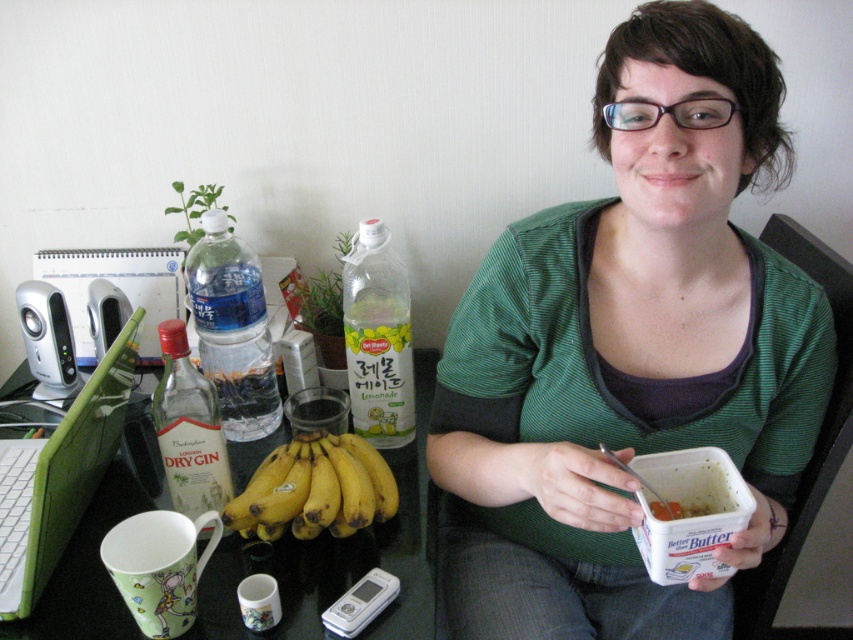
Is green striped shirt at center to the right of translucent plastic bottle at center from the viewer's perspective?

Correct, you'll find green striped shirt at center to the right of translucent plastic bottle at center.

Describe the element at coordinates (630, 349) in the screenshot. This screenshot has width=853, height=640. I see `green striped shirt at center` at that location.

Image resolution: width=853 pixels, height=640 pixels. What do you see at coordinates (630, 349) in the screenshot?
I see `green striped shirt at center` at bounding box center [630, 349].

Locate an element on the screen. green striped shirt at center is located at coordinates pyautogui.click(x=630, y=349).

Who is more distant from viewer, (241, 372) or (759, 600)?

Positioned behind is point (241, 372).

Does point (189, 280) come behind point (843, 416)?

Yes, point (189, 280) is behind point (843, 416).

Who is more forward, (238, 276) or (817, 253)?

Point (817, 253)

Image resolution: width=853 pixels, height=640 pixels. I want to click on clear plastic bottle at left, so click(231, 330).

Looking at this image, is green striped shirt at center positioned in front of matte glass bottle at left?

Yes, it is.

Is green striped shirt at center thinner than matte glass bottle at left?

No.

At what (x,y) coordinates should I click in order to perform the action: click on green striped shirt at center. Please return your answer as a coordinate pair (x, y). This screenshot has height=640, width=853. Looking at the image, I should click on (630, 349).